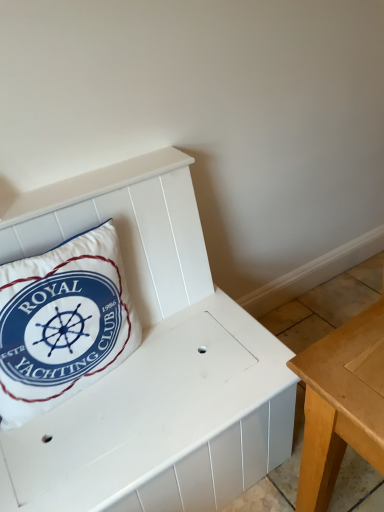
Identify the location of free space above white matte bench at center (from a real-world perspective). (126, 406).